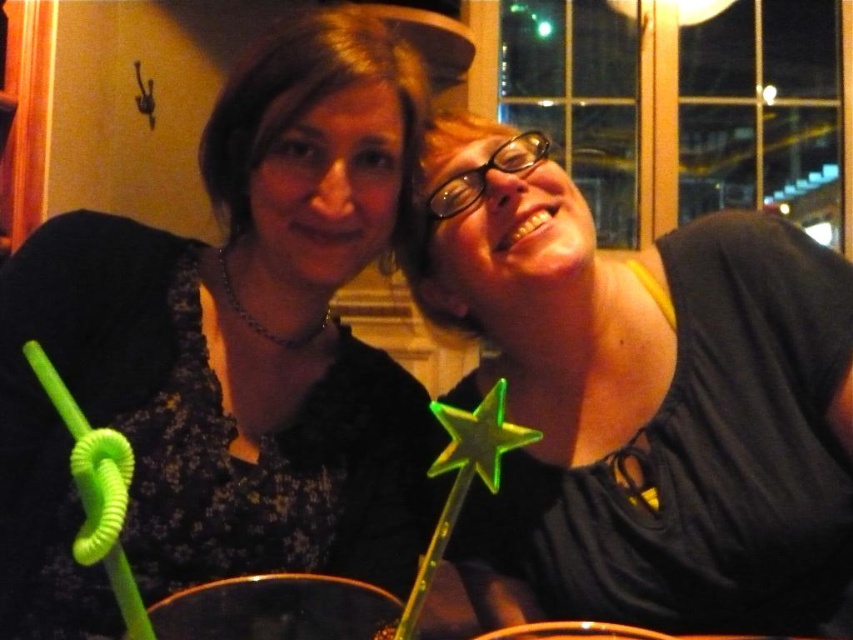
Based on the photo, can you confirm if matte black dress at left is positioned below green plastic wand at upper right?

Incorrect, matte black dress at left is not positioned below green plastic wand at upper right.

Who is more distant from viewer, (392, 360) or (633, 516)?

The point (392, 360) is more distant.

Where is `matte black dress at left`? This screenshot has height=640, width=853. matte black dress at left is located at coordinates (229, 349).

How much distance is there between translucent glass beverage at lower center and green plastic star at center?

translucent glass beverage at lower center is 8.28 inches away from green plastic star at center.

Which is in front, point (372, 600) or point (450, 468)?

Point (450, 468)

Is point (206, 630) less distant than point (471, 435)?

That is False.

Locate an element on the screen. translucent glass beverage at lower center is located at coordinates (276, 609).

Does matte black dress at left have a greater width compared to translucent glass beverage at lower center?

Correct, the width of matte black dress at left exceeds that of translucent glass beverage at lower center.

Which is behind, point (268, 68) or point (202, 612)?

The point (268, 68) is behind.

The height and width of the screenshot is (640, 853). I want to click on matte black dress at left, so click(229, 349).